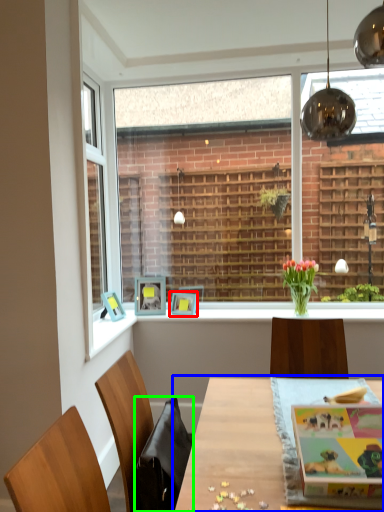
Question: Estimate the real-world distances between objects in this image. Which object is closer to picture frame (highlighted by a red box), table (highlighted by a blue box) or swivel chair (highlighted by a green box)?

Choices:
 (A) table
 (B) swivel chair

Answer: (A)